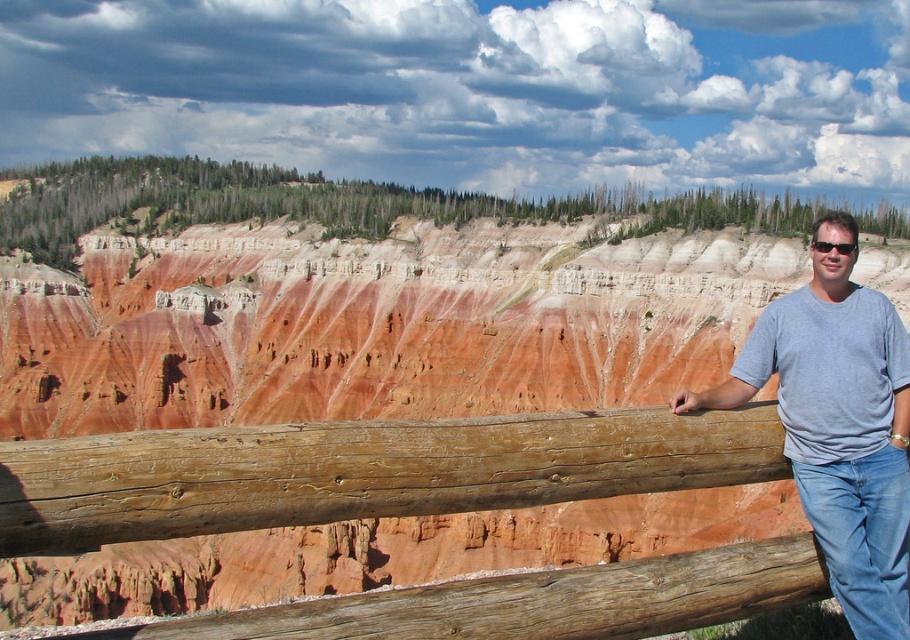
The image size is (910, 640). Find the location of `brown wooden fence at center`. brown wooden fence at center is located at coordinates (364, 470).

Between point (599, 426) and point (877, 342), which one is positioned in front?

Positioned in front is point (599, 426).

The width and height of the screenshot is (910, 640). I want to click on brown wooden fence at center, so click(x=364, y=470).

Does brown wooden fence at center appear on the right side of black plastic sunglasses at right?

Incorrect, brown wooden fence at center is not on the right side of black plastic sunglasses at right.

Between brown wooden fence at center and black plastic sunglasses at right, which one appears on the left side from the viewer's perspective?

Positioned to the left is brown wooden fence at center.

At what (x,y) coordinates should I click in order to perform the action: click on brown wooden fence at center. Please return your answer as a coordinate pair (x, y). This screenshot has width=910, height=640. Looking at the image, I should click on (364, 470).

Is point (872, 417) farther from viewer compared to point (855, 248)?

That is False.

Describe the element at coordinates (838, 429) in the screenshot. I see `gray cotton t-shirt at right` at that location.

Locate an element on the screen. The height and width of the screenshot is (640, 910). gray cotton t-shirt at right is located at coordinates (838, 429).